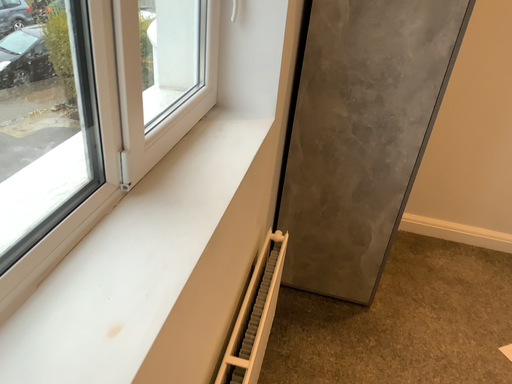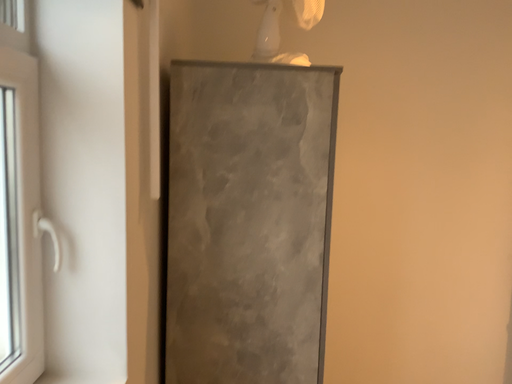
Question: How did the camera likely rotate when shooting the video?

Choices:
 (A) rotated upward
 (B) rotated downward

Answer: (A)